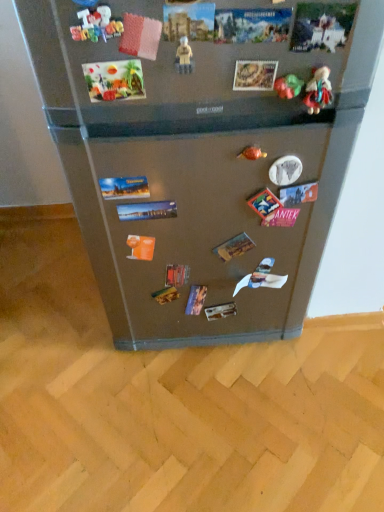
Question: Looking at the image, does multicolored fabric doll at upper right, the fifth toy viewed from the left, seem bigger or smaller compared to satin metallic fridge at center?

Choices:
 (A) big
 (B) small

Answer: (B)

Question: In terms of width, does multicolored fabric doll at upper right, which is the third toy in front-to-back order, look wider or thinner when compared to satin metallic fridge at center?

Choices:
 (A) thin
 (B) wide

Answer: (B)

Question: Estimate the real-world distances between objects in this image. Which object is farther from the metallic gold ring at center, arranged as the third toy when viewed from the right?

Choices:
 (A) satin metallic fridge at center
 (B) rubberized plastic letters at upper left, the 5th toy from the right
 (C) plastic beige figure at center, which appears as the 2th toy when viewed from the front
 (D) multicolored fabric doll at upper right, marked as the 1th toy in a right-to-left arrangement
 (E) green matte toy at upper right, the fourth toy viewed from the front

Answer: (B)

Question: Based on their relative distances, which object is farther from the green matte toy at upper right, marked as the fourth toy in a left-to-right arrangement?

Choices:
 (A) satin metallic fridge at center
 (B) plastic beige figure at center, acting as the fourth toy starting from the right
 (C) metallic gold ring at center, which appears as the fifth toy when viewed from the front
 (D) multicolored fabric doll at upper right, the fifth toy viewed from the left
 (E) rubberized plastic letters at upper left, the first toy positioned from the left

Answer: (A)